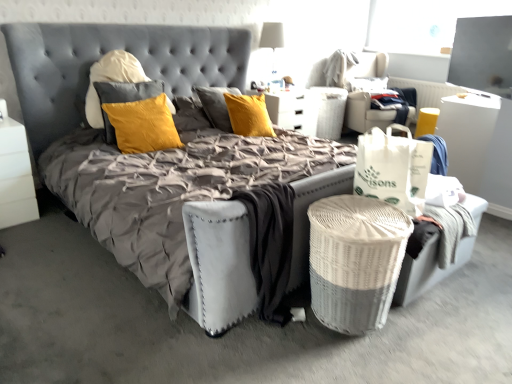
In order to face white paper bag at right, should I rotate leftwards or rightwards?

It's best to rotate right around 17.259 degrees.

Image resolution: width=512 pixels, height=384 pixels. What are the coordinates of `matte white drawer at center` in the screenshot? It's located at (294, 110).

Find the location of a particular element. The width and height of the screenshot is (512, 384). lamp on the left of white wicker laundry basket at lower right is located at coordinates (272, 38).

Considering the sizes of objects white fabric lampshade at upper center and white wicker laundry basket at lower right in the image provided, who is taller, white fabric lampshade at upper center or white wicker laundry basket at lower right?

With more height is white fabric lampshade at upper center.

Does white fabric lampshade at upper center appear on the left side of white wicker laundry basket at lower right?

Yes.

Is white fabric lampshade at upper center with white wicker laundry basket at lower right?

No, white fabric lampshade at upper center is not with white wicker laundry basket at lower right.

Consider the image. Considering their positions, is matte white drawer at center located in front of or behind white paper bag at right?

Visually, matte white drawer at center is located behind white paper bag at right.

Does point (316, 100) come farther from viewer compared to point (384, 170)?

Yes, it is.

In the scene shown: From a real-world perspective, is matte white drawer at center physically below white paper bag at right?

Yes.

Based on the photo, from the image's perspective, does yellow velvet pillow at center appear lower than white fabric lampshade at upper center?

Yes.

Is yellow velvet pillow at center inside the boundaries of white fabric lampshade at upper center, or outside?

yellow velvet pillow at center is outside white fabric lampshade at upper center.

Would you say yellow velvet pillow at center is to the left or to the right of white fabric lampshade at upper center in the picture?

yellow velvet pillow at center is positioned on white fabric lampshade at upper center's left side.

Between yellow velvet pillow at center and white fabric lampshade at upper center, which one has smaller width?

Thinner between the two is yellow velvet pillow at center.

Considering the positions of objects white wicker laundry basket at lower right and white paper bag at right in the image provided, who is in front, white wicker laundry basket at lower right or white paper bag at right?

white wicker laundry basket at lower right is in front.

Considering the sizes of objects white wicker laundry basket at lower right and white paper bag at right in the image provided, who is thinner, white wicker laundry basket at lower right or white paper bag at right?

With smaller width is white paper bag at right.

Is white paper bag at right facing towards white glossy nightstand at left?

→ No, white paper bag at right is not aimed at white glossy nightstand at left.

From the image's perspective, between white paper bag at right and white glossy nightstand at left, who is located below?

white paper bag at right, from the image's perspective.

Between white paper bag at right and white glossy nightstand at left, which one is positioned behind?

white glossy nightstand at left is more distant.

From the picture: How much distance is there between white paper bag at right and white glossy nightstand at left?

A distance of 7.09 feet exists between white paper bag at right and white glossy nightstand at left.

Consider the image. What's the angular difference between yellow velvet pillow at center and white fabric swivel chair at upper right, which appears as the 2th swivel chair when viewed from the right,'s facing directions?

3.71 degrees separate the facing orientations of yellow velvet pillow at center and white fabric swivel chair at upper right, which appears as the 2th swivel chair when viewed from the right.

Who is shorter, yellow velvet pillow at center or white fabric swivel chair at upper right, which appears as the 2th swivel chair when viewed from the right?

With less height is yellow velvet pillow at center.

Which of these two, yellow velvet pillow at center or white fabric swivel chair at upper right, which appears as the 2th swivel chair when viewed from the right, is bigger?

white fabric swivel chair at upper right, which appears as the 2th swivel chair when viewed from the right, is bigger.

Locate an element on the screen. Image resolution: width=512 pixels, height=384 pixels. pillow on the left of white fabric swivel chair at upper right, marked as the 1th swivel chair in a left-to-right arrangement is located at coordinates (137, 116).

Could you tell me if white wicker basket at center is facing white wicker laundry basket at lower right?

No.

Would you say white wicker basket at center is to the left or to the right of white wicker laundry basket at lower right in the picture?

Based on their positions, white wicker basket at center is located to the right of white wicker laundry basket at lower right.

Considering the sizes of objects white wicker basket at center and white wicker laundry basket at lower right in the image provided, who is wider, white wicker basket at center or white wicker laundry basket at lower right?

Wider between the two is white wicker laundry basket at lower right.

From a real-world perspective, is white wicker basket at center positioned above or below white wicker laundry basket at lower right?

white wicker basket at center is situated higher than white wicker laundry basket at lower right in the real world.

There is a white wicker laundry basket at lower right. Where is `lamp above it (from a real-world perspective)`? lamp above it (from a real-world perspective) is located at coordinates (272, 38).

The image size is (512, 384). In order to click on shopping bag lying on the right of matte white drawer at center in this screenshot , I will do `click(393, 168)`.

Which object lies further to the anchor point white wicker laundry basket at lower right, white fabric swivel chair at upper right, marked as the 1th swivel chair in a left-to-right arrangement, or transparent glass window screen at upper right?

white fabric swivel chair at upper right, marked as the 1th swivel chair in a left-to-right arrangement.

Considering their positions, is transparent glass window screen at upper right positioned further to white glossy nightstand at left than matte white drawer at center?

transparent glass window screen at upper right.

Which object lies further to the anchor point yellow velvet pillow at center, white fabric lampshade at upper center or matte white drawer at center?

white fabric lampshade at upper center.

Estimate the real-world distances between objects in this image. Which object is closer to matte white drawer at center, transparent glass window screen at upper right or white paper bag at right?

The object closer to matte white drawer at center is transparent glass window screen at upper right.

Looking at the image, which one is located further to white fabric lampshade at upper center, transparent glass window screen at upper right or yellow fabric swivel chair at upper right, the first swivel chair when ordered from right to left?

transparent glass window screen at upper right lies further to white fabric lampshade at upper center than the other object.

From the image, which object appears to be farther from white paper bag at right, white fabric swivel chair at upper right, which appears as the 2th swivel chair when viewed from the right, or white wicker basket at center?

white fabric swivel chair at upper right, which appears as the 2th swivel chair when viewed from the right.

From the image, which object appears to be nearer to yellow velvet pillow at center, white fabric swivel chair at upper right, which appears as the 2th swivel chair when viewed from the right, or white wicker laundry basket at lower right?

The object closer to yellow velvet pillow at center is white wicker laundry basket at lower right.

Looking at the image, which one is located closer to yellow velvet pillow at center, white wicker laundry basket at lower right or white paper bag at right?

white paper bag at right lies closer to yellow velvet pillow at center than the other object.

You are a GUI agent. You are given a task and a screenshot of the screen. Output one action in this format:
    pyautogui.click(x=<x>, y=<y>)
    Task: Click on the pillow located between white paper bag at right and matte white drawer at center in the depth direction
    Image resolution: width=512 pixels, height=384 pixels.
    Given the screenshot: What is the action you would take?
    pyautogui.click(x=137, y=116)

Locate an element on the screen. lamp between yellow velvet pillow at center and white fabric swivel chair at upper right, marked as the 1th swivel chair in a left-to-right arrangement is located at coordinates (272, 38).

This screenshot has height=384, width=512. What are the coordinates of `pillow located between white glossy nightstand at left and transparent glass window screen at upper right in the left-right direction` in the screenshot? It's located at (137, 116).

Where is `pillow between white wicker laundry basket at lower right and white fabric swivel chair at upper right, marked as the 1th swivel chair in a left-to-right arrangement, in the front-back direction`? The width and height of the screenshot is (512, 384). pillow between white wicker laundry basket at lower right and white fabric swivel chair at upper right, marked as the 1th swivel chair in a left-to-right arrangement, in the front-back direction is located at coordinates (137, 116).